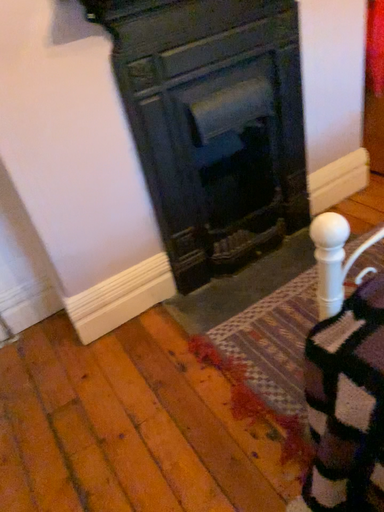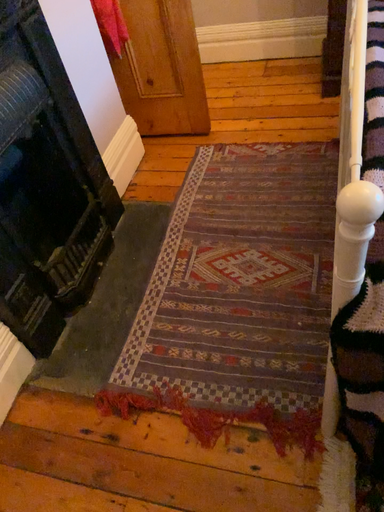
Question: How did the camera likely rotate when shooting the video?

Choices:
 (A) rotated downward
 (B) rotated upward

Answer: (B)